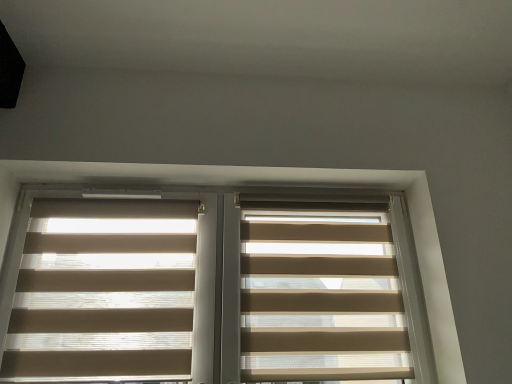
Question: Considering the positions of beige fabric blinds at center, the first window blind in the right-to-left sequence, and beige translucent blinds at center in the image, is beige fabric blinds at center, the first window blind in the right-to-left sequence, bigger or smaller than beige translucent blinds at center?

Choices:
 (A) small
 (B) big

Answer: (A)

Question: From their relative heights in the image, would you say beige fabric blinds at center, marked as the 2th window blind in a left-to-right arrangement, is taller or shorter than beige translucent blinds at center?

Choices:
 (A) short
 (B) tall

Answer: (A)

Question: Which is nearer to the beige fabric blinds at center, the first window blind in the right-to-left sequence?

Choices:
 (A) beige translucent blinds at center
 (B) beige translucent blinds at left, positioned as the 1th window blind in left-to-right order

Answer: (A)

Question: Estimate the real-world distances between objects in this image. Which object is closer to the beige fabric blinds at center, marked as the 2th window blind in a left-to-right arrangement?

Choices:
 (A) beige translucent blinds at left, positioned as the 1th window blind in left-to-right order
 (B) beige translucent blinds at center

Answer: (B)